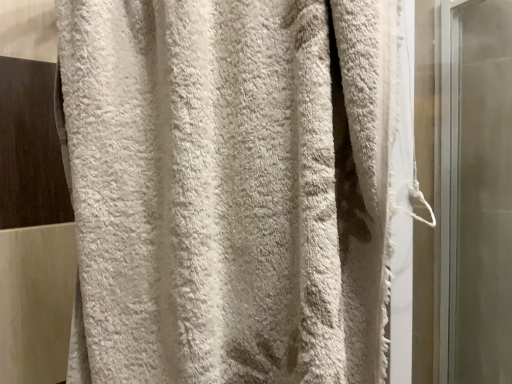
What do you see at coordinates (233, 187) in the screenshot? The width and height of the screenshot is (512, 384). I see `white fluffy towel at left` at bounding box center [233, 187].

Where is `white fluffy towel at left`? The height and width of the screenshot is (384, 512). white fluffy towel at left is located at coordinates (233, 187).

This screenshot has height=384, width=512. What are the coordinates of `white fluffy towel at left` in the screenshot? It's located at [233, 187].